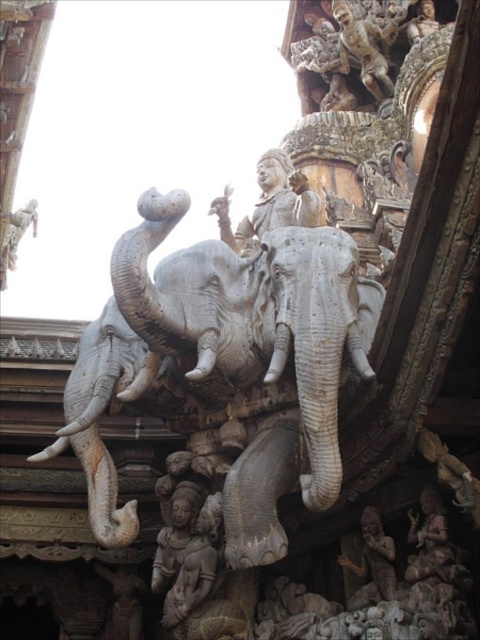
Question: Is gray stone elephant at left smaller than carved stone statue at center?

Choices:
 (A) no
 (B) yes

Answer: (A)

Question: Which point is farther to the camera?

Choices:
 (A) (392, 554)
 (B) (120, 364)
 (C) (189, 564)

Answer: (B)

Question: Is gray stone elephant at center behind carved stone statue at center?

Choices:
 (A) yes
 (B) no

Answer: (B)

Question: Which point appears closest to the camera in this image?

Choices:
 (A) (111, 461)
 (B) (374, 579)

Answer: (B)

Question: Is gray stone elephant at left further to the viewer compared to polished bronze statue at lower right?

Choices:
 (A) yes
 (B) no

Answer: (A)

Question: Which point is closer to the camera taking this photo?

Choices:
 (A) (98, 458)
 (B) (381, 563)
 (C) (165, 604)

Answer: (B)